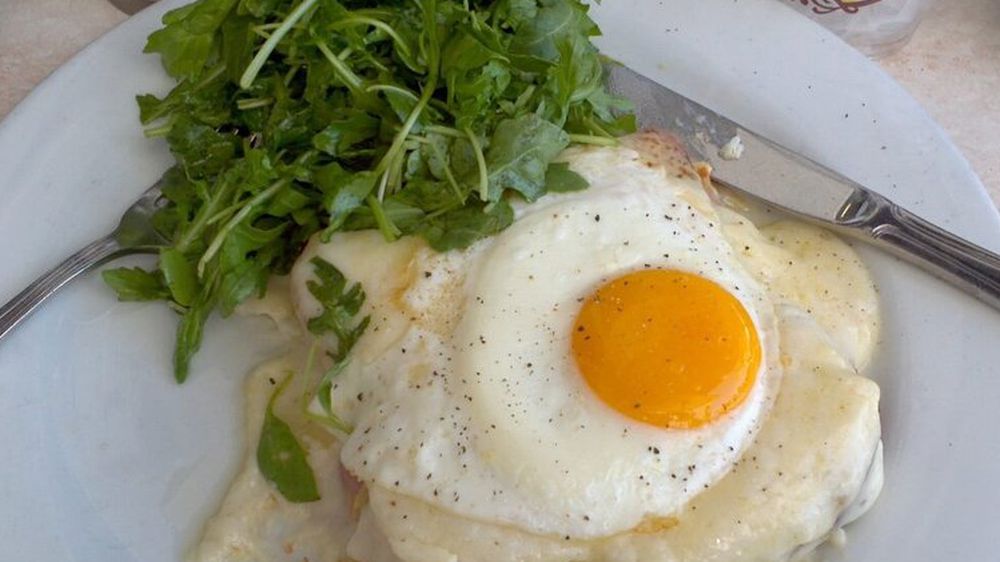
Where is `possible silver fork`? The height and width of the screenshot is (562, 1000). possible silver fork is located at coordinates (53, 275), (153, 208).